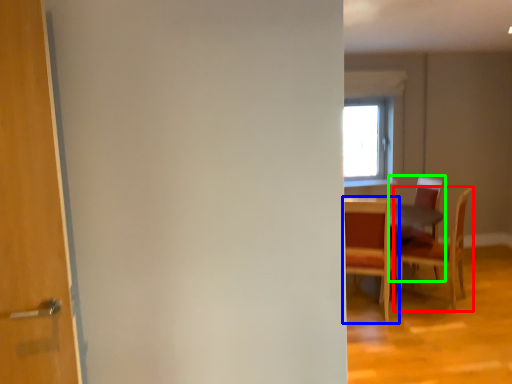
Question: Based on their relative distances, which object is nearer to chair (highlighted by a red box)? Choose from chair (highlighted by a blue box) and chair (highlighted by a green box).

Choices:
 (A) chair
 (B) chair

Answer: (B)